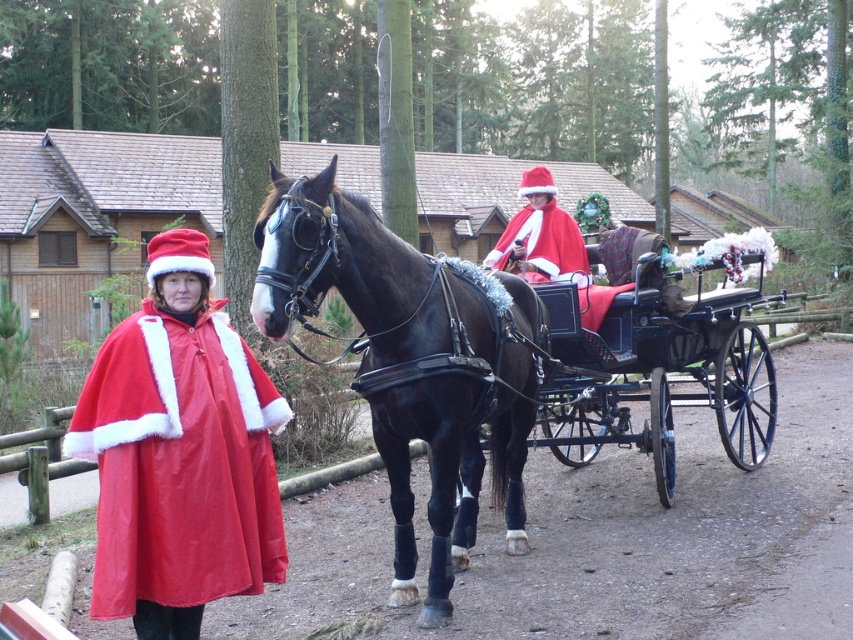
You are standing in front of the Santa Claus figures in the image. Which of the two points, point (729, 381) or point (531, 170), is closer to you?

Point (729, 381) is closer to the viewer than point (531, 170).

You are a photographer trying to capture both the shiny red cape at left and the velvet red cape at center in a single shot. Which cape should you focus on first to ensure both are in frame?

You should focus on the shiny red cape at left first because it is positioned under the velvet red cape at center, so adjusting the camera angle to include the lower positioned cape will naturally include the one above.